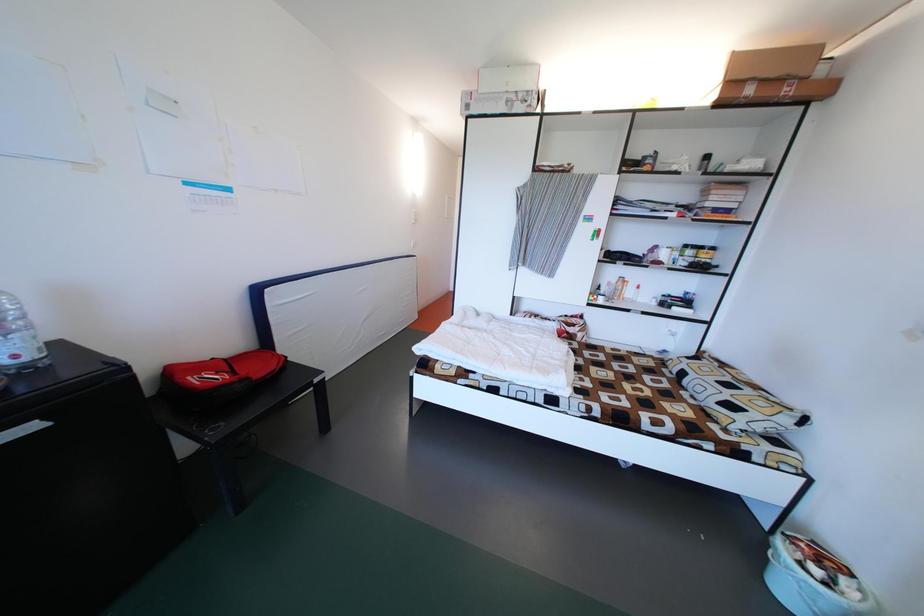
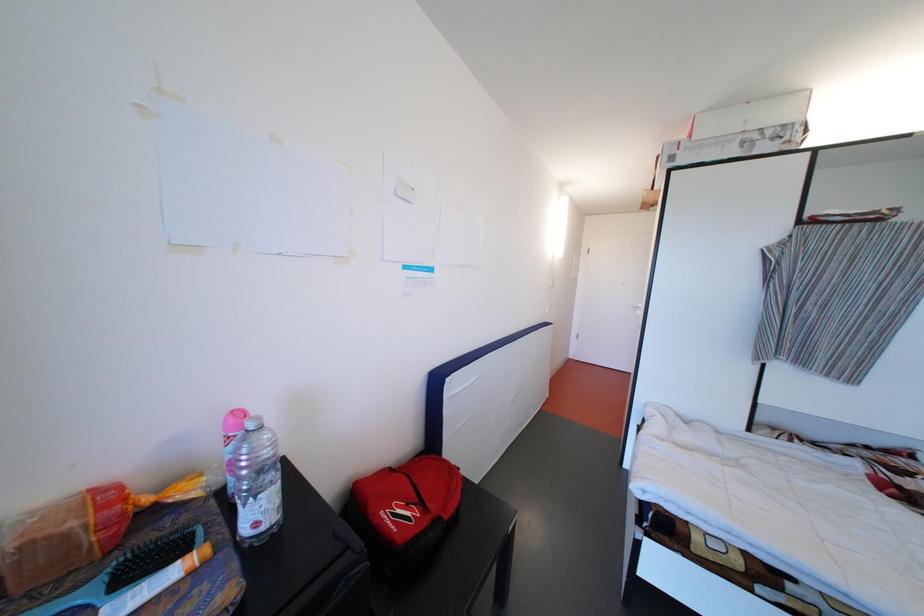
Question: The first image is from the beginning of the video and the second image is from the end. How did the camera likely rotate when shooting the video?

Choices:
 (A) Left
 (B) Right
 (C) Up
 (D) Down

Answer: (A)